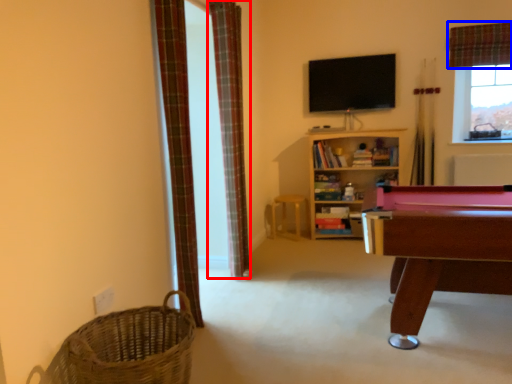
Question: Which point is closer to the camera, curtain (highlighted by a red box) or curtain (highlighted by a blue box)?

Choices:
 (A) curtain
 (B) curtain

Answer: (A)